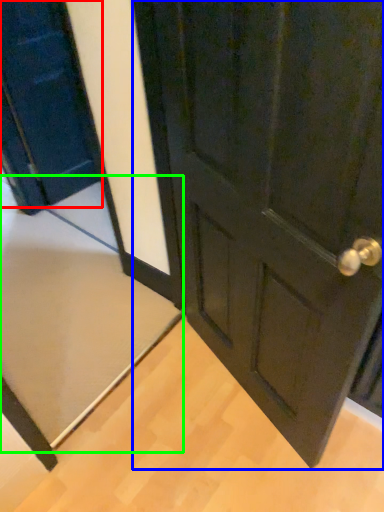
Question: Which object is positioned farthest from door (highlighted by a red box)? Select from door (highlighted by a blue box) and doormat (highlighted by a green box).

Choices:
 (A) door
 (B) doormat

Answer: (A)